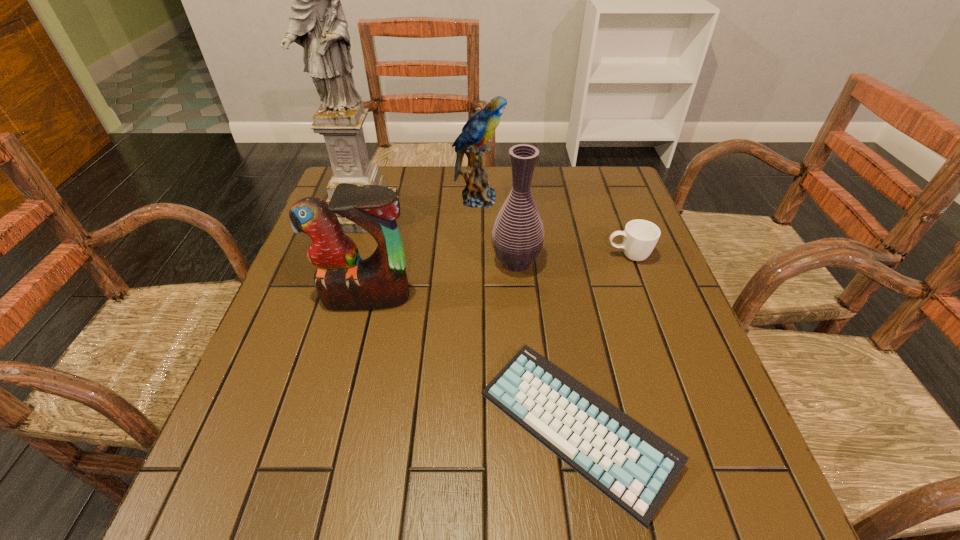
This screenshot has width=960, height=540. I want to click on free space located on the front of the vase, so click(x=519, y=298).

The height and width of the screenshot is (540, 960). I want to click on vacant space located at the face of the nearer parrot, so click(x=355, y=342).

At what (x,y) coordinates should I click in order to perform the action: click on free spot located 0.140m with the handle on the side of the fifth tallest object. Please return your answer as a coordinate pair (x, y). This screenshot has width=960, height=540. Looking at the image, I should click on (550, 256).

Identify the location of free space located 0.380m with the handle on the side of the fifth tallest object. Image resolution: width=960 pixels, height=540 pixels. (455, 256).

Identify the location of vacant space situated with the handle on the side of the fifth tallest object. This screenshot has height=540, width=960. (526, 256).

Find the location of a particular element. The width and height of the screenshot is (960, 540). free location located on the back of the shortest object is located at coordinates (544, 234).

Find the location of a particular element. sculpture present at the far edge is located at coordinates (317, 23).

The width and height of the screenshot is (960, 540). In order to click on parrot present at the far edge in this screenshot , I will do `click(481, 126)`.

You are a GUI agent. You are given a task and a screenshot of the screen. Output one action in this format:
    pyautogui.click(x=<x>, y=<y>)
    Task: Click on the object at the near edge
    The height and width of the screenshot is (540, 960).
    Given the screenshot: What is the action you would take?
    pyautogui.click(x=632, y=466)

Image resolution: width=960 pixels, height=540 pixels. I want to click on sculpture at the left edge, so [317, 23].